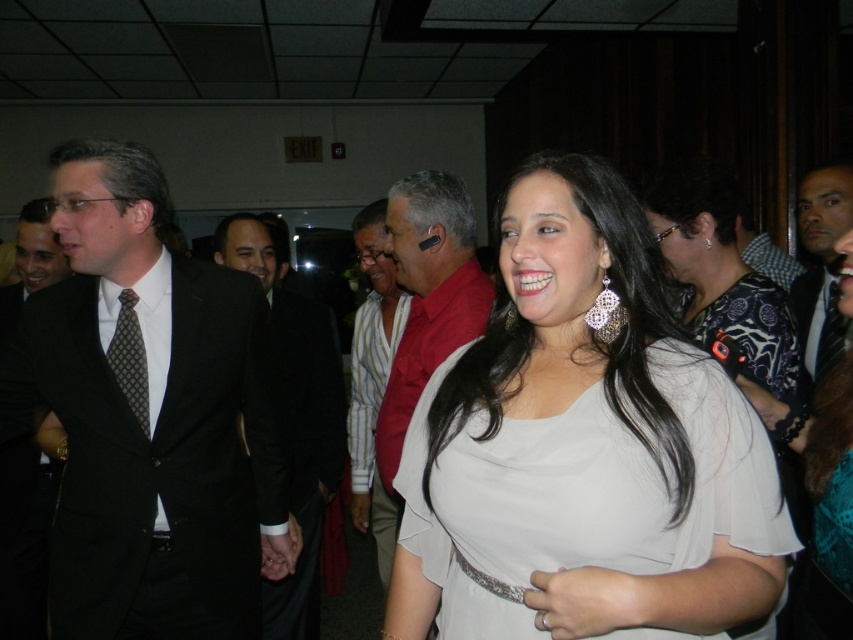
You are a photographer at this event and want to capture a photo of the light beige fabric dress at center without the dark gray suit at right appearing in the background. Is the current positioning suitable for this?

The light beige fabric dress at center is in front of the dark gray suit at right, so yes, the current positioning allows the photographer to capture the dress without the suit appearing in the background.

You are at a formal event and need to approach the black suit at left and the striped fabric shirt at center. Which one should you approach first to greet them properly?

You should approach the black suit at left first because it is in front of the striped fabric shirt at center, so it is closer to you.

You are a photographer setting up for a group photo. You need to ensure that the light beige fabric dress at center and the dark gray textured tie at left are both visible in the frame. Given their relative heights, which one might you need to adjust the camera angle to accommodate?

The light beige fabric dress at center is taller than the dark gray textured tie at left, so you might need to lower the camera angle to ensure the dress is fully visible without cropping the top while keeping the tie in frame.